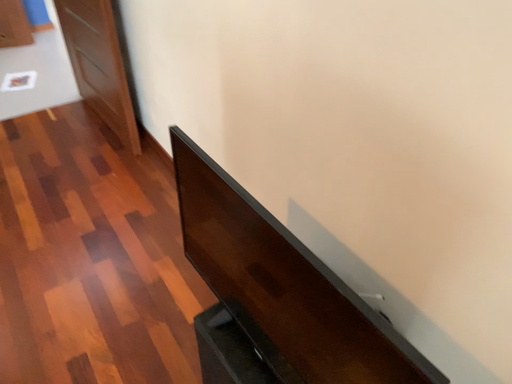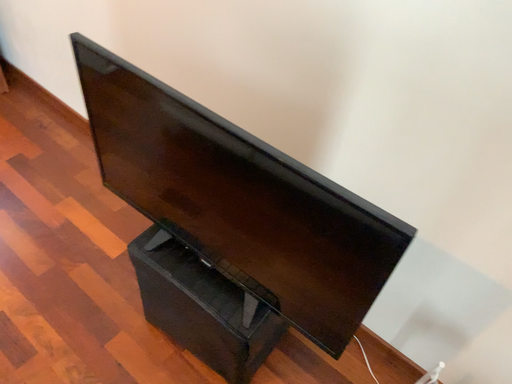
Question: Which way did the camera rotate in the video?

Choices:
 (A) rotated downward
 (B) rotated upward

Answer: (A)